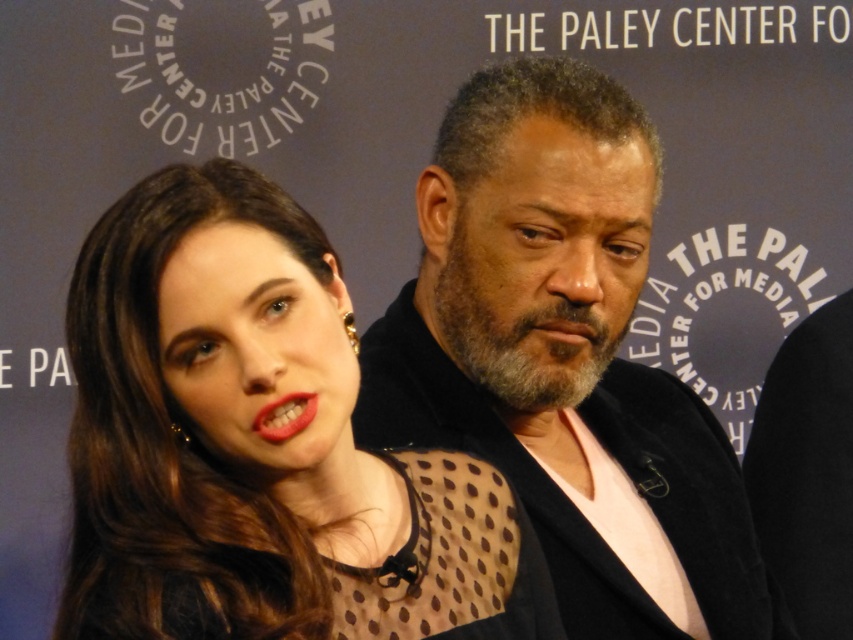
Find the location of a particular element. This screenshot has height=640, width=853. matte black dress at center is located at coordinates (259, 444).